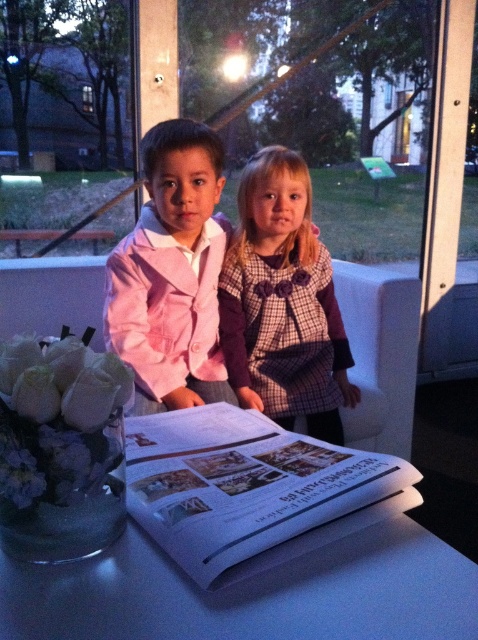
You are a photographer standing at the entrance of the room. You want to capture a photo of the matte pink jacket at center without including any other objects in the frame. Based on its position, where should you aim your camera?

The matte pink jacket at center is located at the 2D coordinates point (172, 273), so you should aim your camera precisely at that point to capture it without including other objects.